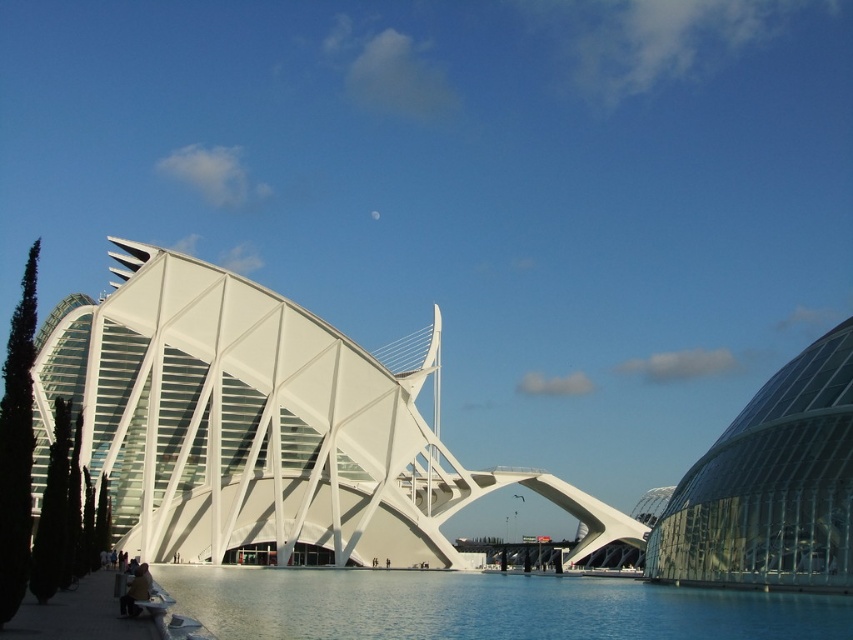
You are a tourist standing at the entrance of the futuristic building. You want to cross to the other side but need to know the distance between the white glass bridge at center and the transparent blue water at center. Is the distance more than 20 meters?

The white glass bridge at center is 25.30 meters away from the transparent blue water at center, so yes, the distance is more than 20 meters.

You are standing in front of the architectural structure and want to determine the relative positions of two points on its roof. The first point is labeled as point (x=804, y=637) and the second is point (x=764, y=568). Which of these two points is closer to your current position?

Point (x=804, y=637) is closer to the viewer than point (x=764, y=568).

You are standing in front of the futuristic building and want to take a photo of the transparent blue water at center and the transparent glass dome at right. Which object should you point your camera downward to capture?

You should point your camera downward to capture the transparent blue water at center because it is located below the transparent glass dome at right.